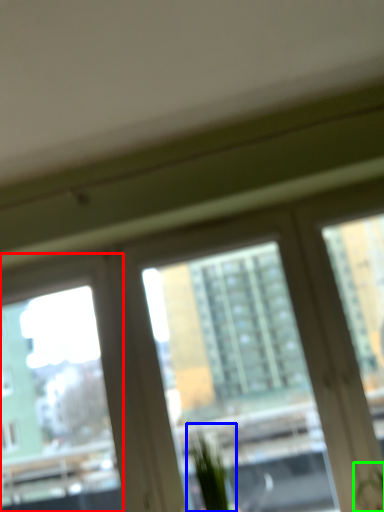
Question: Which is farther away from window screen (highlighted by a red box)? plant (highlighted by a blue box) or plant (highlighted by a green box)?

Choices:
 (A) plant
 (B) plant

Answer: (B)